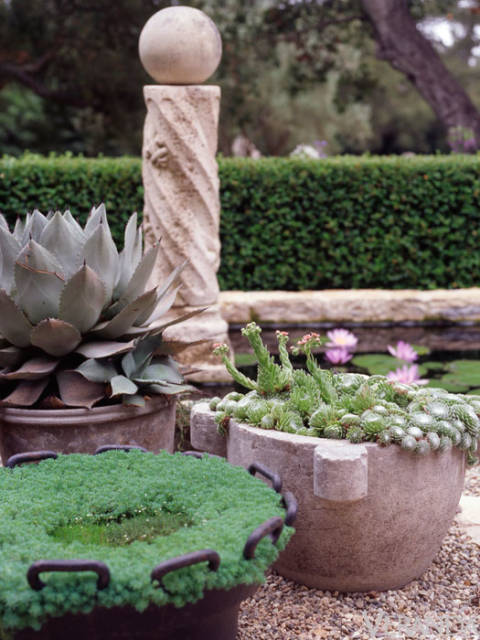
Where is `planter`? This screenshot has height=640, width=480. planter is located at coordinates (215, 621), (407, 530), (162, 424).